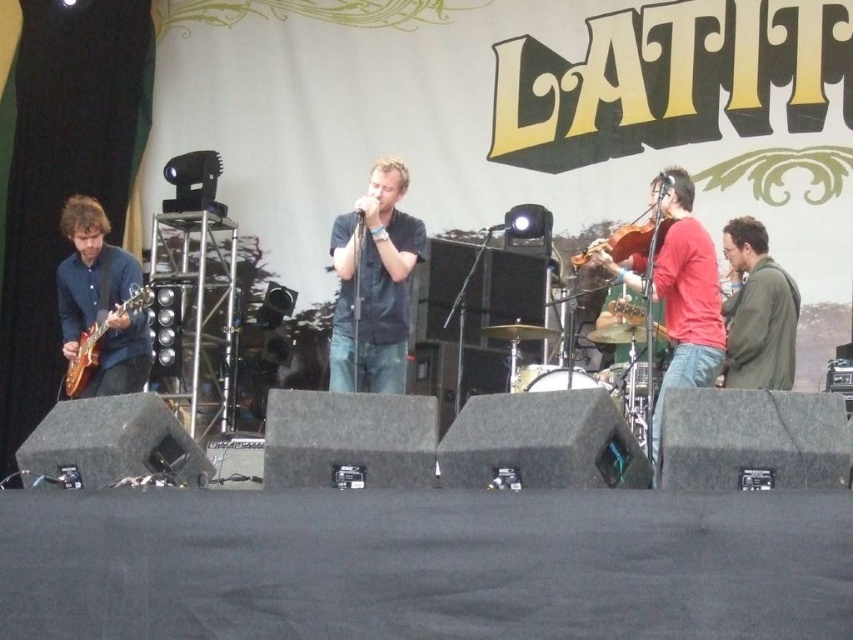
You are a stagehand who needs to adjust the microphone stand for the electric wood guitar at left and the brown wooden violin at center right. Which instrument should you adjust first if you want to start from the left side of the stage?

The electric wood guitar at left should be adjusted first since it is positioned to the left of the brown wooden violin at center right.

You are a photographer at the event and want to capture a photo of the dark blue shirt at center and electric wood guitar at left. Based on their positions, which one should you focus on first if you want to frame them from left to right?

The electric wood guitar at left should be focused first since the dark blue shirt at center is to the right of it, so arranging them from left to right would place the electric wood guitar at left first followed by the dark blue shirt at center.